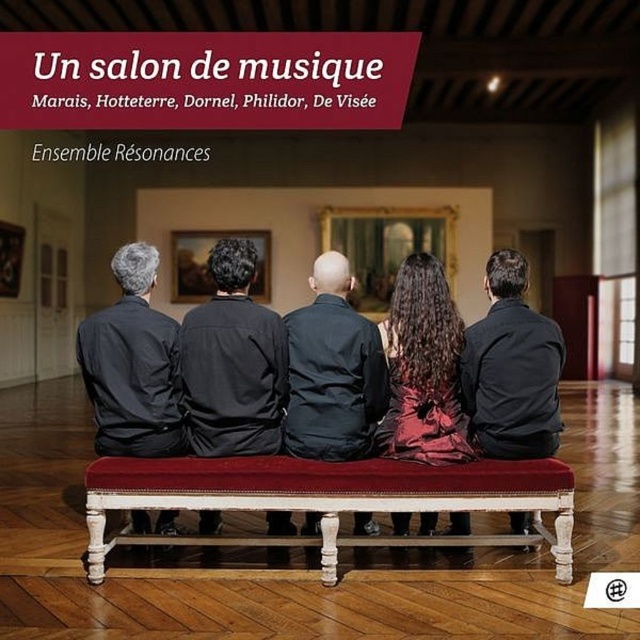
Identify the location of velvet-covered bench at center. point(330,499).

Does velvet-covered bench at center have a larger size compared to black matte shirt at center?

Indeed, velvet-covered bench at center has a larger size compared to black matte shirt at center.

Describe the element at coordinates (330, 499) in the screenshot. The image size is (640, 640). I see `velvet-covered bench at center` at that location.

Find the location of a particular element. velvet-covered bench at center is located at coordinates (330, 499).

From the picture: Is matte black shirt at left smaller than black matte shirt at center?

Indeed, matte black shirt at left has a smaller size compared to black matte shirt at center.

Does matte black shirt at left appear on the right side of black matte shirt at center?

In fact, matte black shirt at left is to the left of black matte shirt at center.

Identify the location of matte black shirt at left. Image resolution: width=640 pixels, height=640 pixels. (132, 365).

Between point (545, 368) and point (336, 410), which one is positioned behind?

Point (545, 368)

I want to click on black matte shirt at center, so click(512, 369).